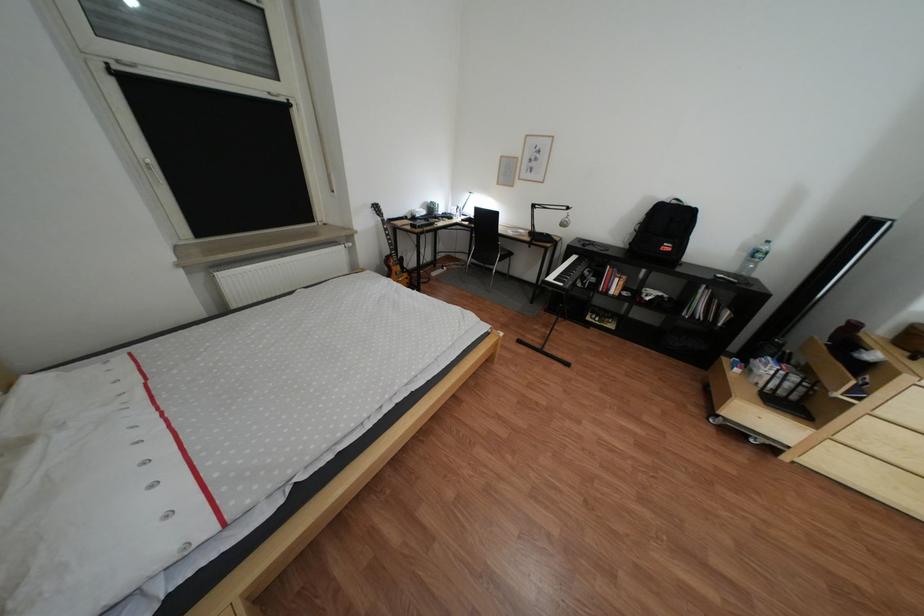
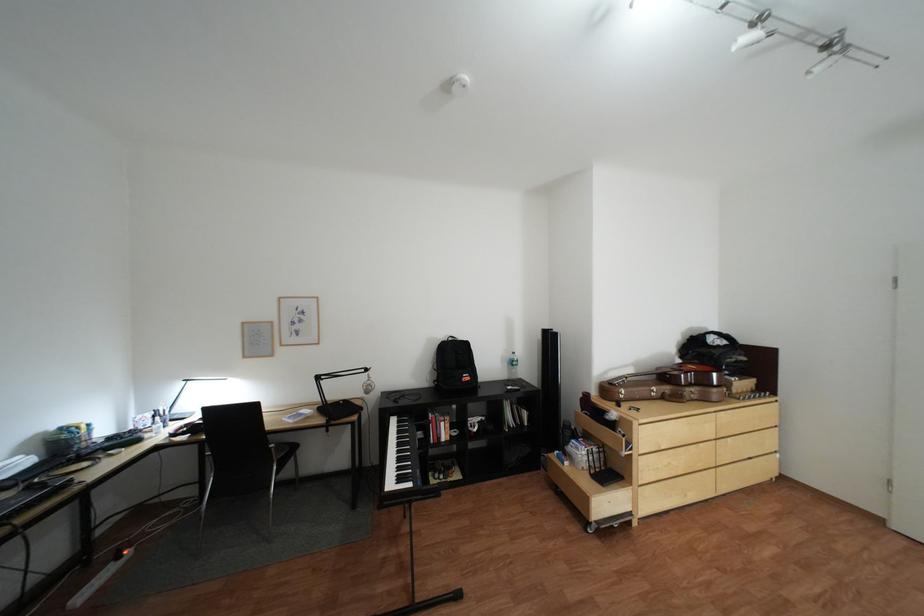
Where in the second image is the point corresponding to (x=743, y=397) from the first image?

(602, 500)